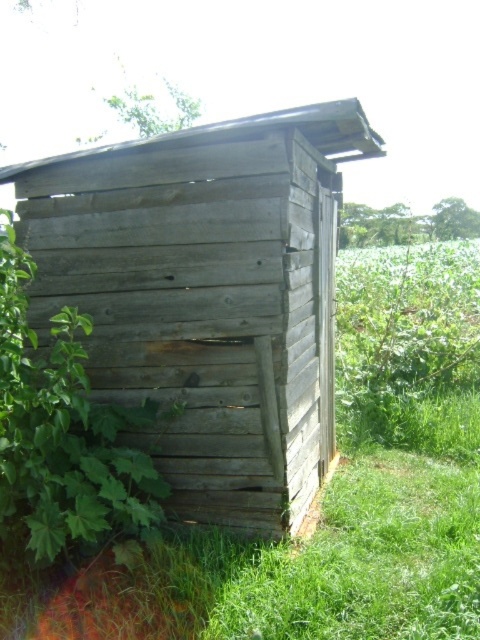
You are standing in a rural area and see a point marked at coordinates (206, 296). Based on the scene description, what object is located at that point?

The point at coordinates (206, 296) corresponds to the weathered wood hut at center.

You are a gardener who wants to water the green leafy plant at left. The weathered wood hut at center is in the way. Can you move around the hut to reach the plant?

The weathered wood hut at center is positioned over green leafy plant at left, so the hut is directly above the plant. This means you cannot move around the hut to reach the plant because the plant is underneath it.

You are standing in a rural area and see the weathered wood hut at center and the green leafy plant at left. Which object is wider?

The weathered wood hut at center is wider than the green leafy plant at left.